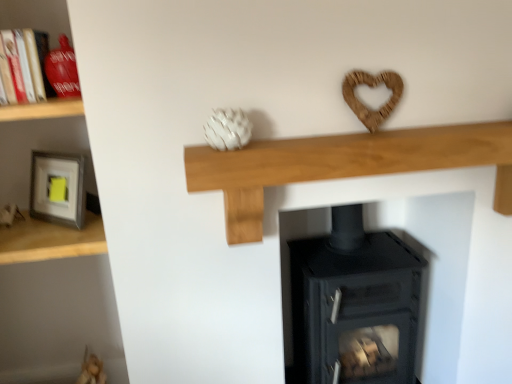
Question: From a real-world perspective, is matte gray frame at left, arranged as the third shelf when viewed from the right, on natural wood mantle at center, which ranks as the first shelf in right-to-left order?

Choices:
 (A) no
 (B) yes

Answer: (A)

Question: From a real-world perspective, is matte gray frame at left, arranged as the third shelf when viewed from the right, physically below natural wood mantle at center, which ranks as the first shelf in right-to-left order?

Choices:
 (A) no
 (B) yes

Answer: (B)

Question: From the image's perspective, is matte gray frame at left, which ranks as the second shelf in left-to-right order, over natural wood mantle at center, which ranks as the first shelf in right-to-left order?

Choices:
 (A) no
 (B) yes

Answer: (A)

Question: Does matte gray frame at left, arranged as the third shelf when viewed from the right, have a smaller size compared to natural wood mantle at center, which ranks as the first shelf in right-to-left order?

Choices:
 (A) yes
 (B) no

Answer: (A)

Question: Does matte gray frame at left, which ranks as the second shelf in left-to-right order, have a lesser height compared to natural wood mantle at center, placed as the 4th shelf when sorted from left to right?

Choices:
 (A) yes
 (B) no

Answer: (A)

Question: Does matte gray frame at left, which ranks as the second shelf in left-to-right order, have a greater height compared to natural wood mantle at center, placed as the 4th shelf when sorted from left to right?

Choices:
 (A) no
 (B) yes

Answer: (A)

Question: Considering the relative sizes of matte gray frame at left, arranged as the fourth shelf when viewed from the right, and wooden shelf at left, acting as the 3th shelf starting from the left, in the image provided, is matte gray frame at left, arranged as the fourth shelf when viewed from the right, shorter than wooden shelf at left, acting as the 3th shelf starting from the left,?

Choices:
 (A) yes
 (B) no

Answer: (B)

Question: Can you confirm if matte gray frame at left, which appears as the first shelf when viewed from the left, is wider than wooden shelf at left, which appears as the 2th shelf when viewed from the right?

Choices:
 (A) yes
 (B) no

Answer: (B)

Question: Is matte gray frame at left, which appears as the first shelf when viewed from the left, in front of wooden shelf at left, which appears as the 2th shelf when viewed from the right?

Choices:
 (A) yes
 (B) no

Answer: (A)

Question: Does matte gray frame at left, arranged as the fourth shelf when viewed from the right, have a greater height compared to wooden shelf at left, acting as the 3th shelf starting from the left?

Choices:
 (A) no
 (B) yes

Answer: (B)

Question: Is matte gray frame at left, arranged as the fourth shelf when viewed from the right, in contact with wooden shelf at left, acting as the 3th shelf starting from the left?

Choices:
 (A) no
 (B) yes

Answer: (A)

Question: Is matte gray frame at left, arranged as the fourth shelf when viewed from the right, aimed at wooden shelf at left, acting as the 3th shelf starting from the left?

Choices:
 (A) yes
 (B) no

Answer: (A)

Question: Is matte gray frame at left, arranged as the third shelf when viewed from the right, to the right of matte gray frame at left, arranged as the fourth shelf when viewed from the right, from the viewer's perspective?

Choices:
 (A) no
 (B) yes

Answer: (B)